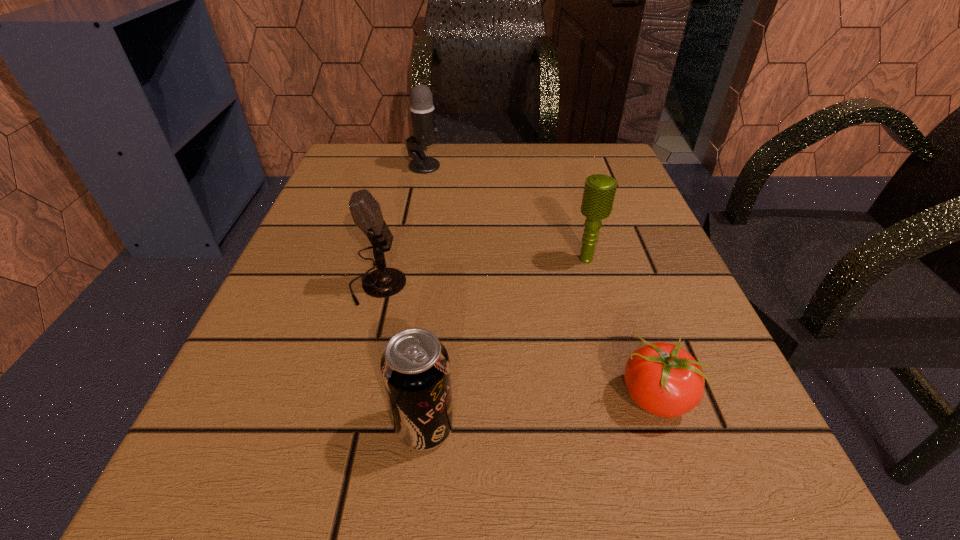
Locate which object ranks in proximity to the third nearest object. Please provide its 2D coordinates. Your answer should be formatted as a tuple, i.e. [(x, y)], where the tuple contains the x and y coordinates of a point satisfying the conditions above.

[(415, 368)]

Select which microphone is the closest to the rightmost microphone. Please provide its 2D coordinates. Your answer should be formatted as a tuple, i.e. [(x, y)], where the tuple contains the x and y coordinates of a point satisfying the conditions above.

[(384, 282)]

Locate which microphone ranks second in proximity to the farthest object. Please provide its 2D coordinates. Your answer should be formatted as a tuple, i.e. [(x, y)], where the tuple contains the x and y coordinates of a point satisfying the conditions above.

[(599, 192)]

Where is `vacant space that satisfies the following two spatial constraints: 1. on the front-facing side of the third farthest object; 2. on the left side of the shortest object`? The image size is (960, 540). vacant space that satisfies the following two spatial constraints: 1. on the front-facing side of the third farthest object; 2. on the left side of the shortest object is located at coordinates (348, 398).

Identify the location of free space that satisfies the following two spatial constraints: 1. on the back side of the soda can; 2. on the right side of the second farthest object. This screenshot has height=540, width=960. (442, 259).

At what (x,y) coordinates should I click in order to perform the action: click on free location that satisfies the following two spatial constraints: 1. on the back side of the tomato; 2. on the front-facing side of the nearest microphone. Please return your answer as a coordinate pair (x, y). Looking at the image, I should click on click(616, 286).